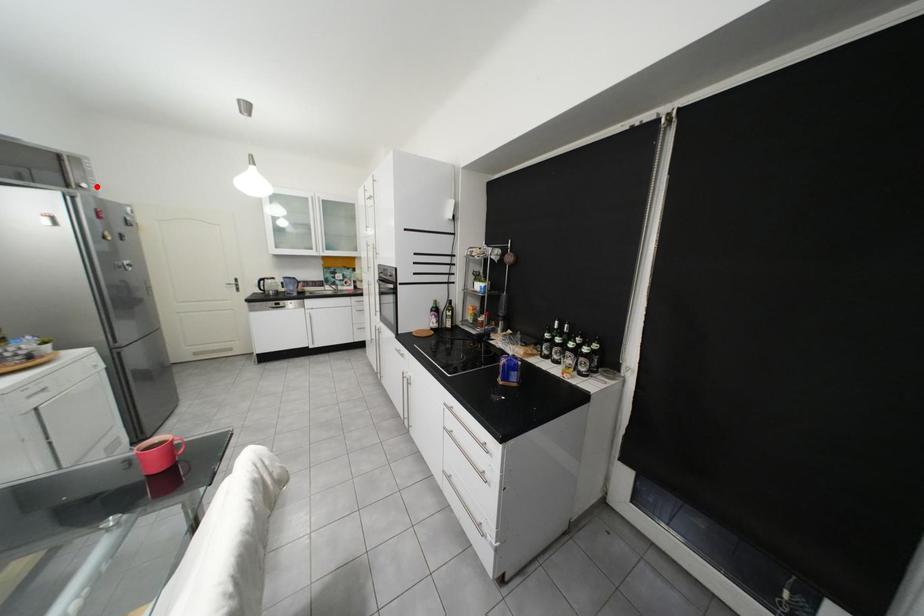
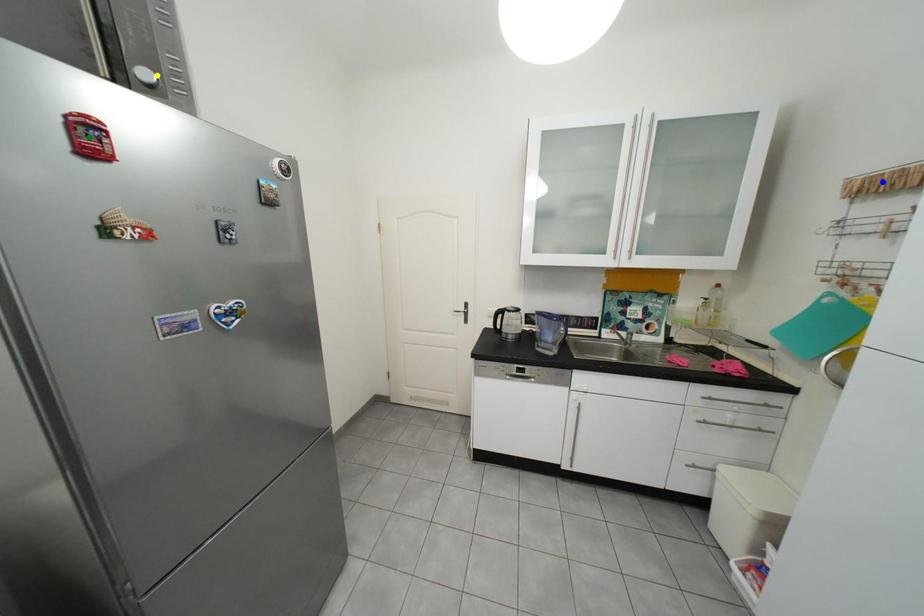
Question: I am providing you with two images of the same scene from different viewpoints. A red point is marked on the first image. You are given multiple points on the second image. In image 2, which mark is for the same physical point as the one in image 1?

Choices:
 (A) blue point
 (B) green point
 (C) yellow point

Answer: (C)